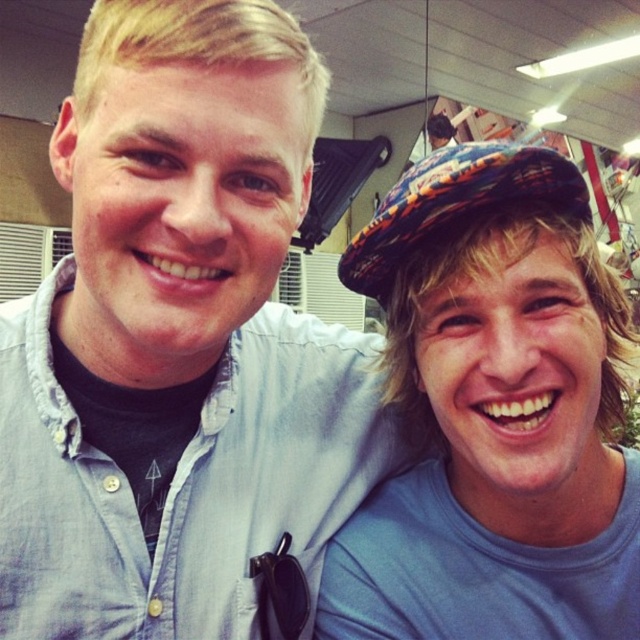
Which is in front, point (138, 129) or point (369, 289)?

Point (138, 129) is more forward.

Does blue denim shirt at center appear over plaid fabric hat at upper right?

Incorrect, blue denim shirt at center is not positioned above plaid fabric hat at upper right.

Describe the element at coordinates (177, 340) in the screenshot. This screenshot has width=640, height=640. I see `blue denim shirt at center` at that location.

The width and height of the screenshot is (640, 640). I want to click on blue denim shirt at center, so click(x=177, y=340).

Does blue denim shirt at center appear under blue fabric shirt at right?

Actually, blue denim shirt at center is above blue fabric shirt at right.

Between point (180, 426) and point (548, 168), which one is positioned behind?

The point (180, 426) is behind.

You are a GUI agent. You are given a task and a screenshot of the screen. Output one action in this format:
    pyautogui.click(x=<x>, y=<y>)
    Task: Click on the blue denim shirt at center
    This screenshot has width=640, height=640.
    Given the screenshot: What is the action you would take?
    pyautogui.click(x=177, y=340)

Can you confirm if blue fabric shirt at right is smaller than plaid fabric hat at upper right?

Actually, blue fabric shirt at right might be larger than plaid fabric hat at upper right.

Who is more distant from viewer, (449,604) or (397,240)?

The point (449,604) is more distant.

Is point (492, 141) positioned in front of point (580, 198)?

No, (492, 141) is further to viewer.

Identify the location of blue fabric shirt at right. Image resolution: width=640 pixels, height=640 pixels. (493, 413).